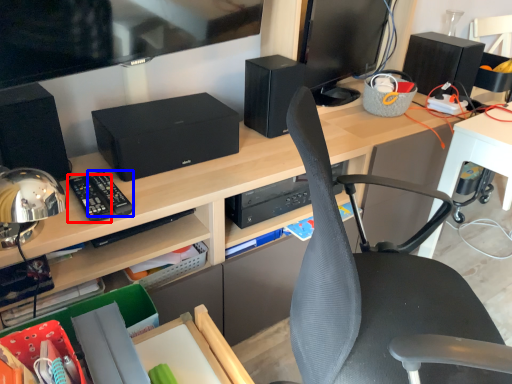
Question: Which object is closer to the camera taking this photo, control (highlighted by a red box) or control (highlighted by a blue box)?

Choices:
 (A) control
 (B) control

Answer: (A)